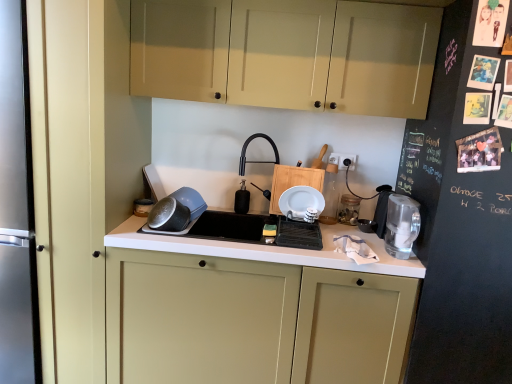
Find the location of `free location in front of matte black container at left, the fourth appliance when ordered from right to left`. free location in front of matte black container at left, the fourth appliance when ordered from right to left is located at coordinates (134, 222).